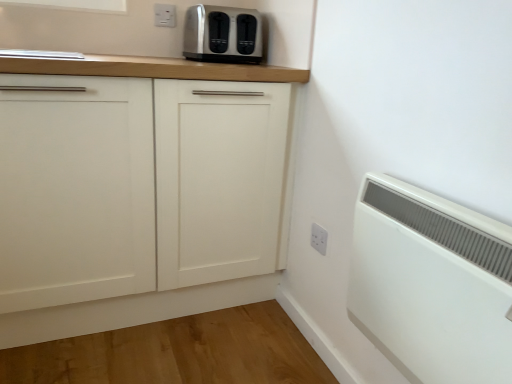
This screenshot has width=512, height=384. Describe the element at coordinates (165, 15) in the screenshot. I see `white plastic electric outlet at upper center, the 1th electric outlet from the top` at that location.

Measure the distance between point (x=104, y=155) and camera.

Point (x=104, y=155) and camera are 4.18 feet apart.

The width and height of the screenshot is (512, 384). What do you see at coordinates (223, 34) in the screenshot?
I see `satin silver toaster at upper center` at bounding box center [223, 34].

In order to click on white plastic electric outlet at upper center, the 1th electric outlet from the top in this screenshot , I will do `click(165, 15)`.

From a real-world perspective, is satin silver toaster at upper center physically located above or below white plastic electric outlet at center, the second electric outlet positioned from the back?

satin silver toaster at upper center is situated higher than white plastic electric outlet at center, the second electric outlet positioned from the back, in the real world.

You are a GUI agent. You are given a task and a screenshot of the screen. Output one action in this format:
    pyautogui.click(x=<x>, y=<y>)
    Task: Click on the electric outlet that is on the right side of satin silver toaster at upper center
    The image size is (512, 384).
    Given the screenshot: What is the action you would take?
    pyautogui.click(x=319, y=238)

Considering the relative sizes of satin silver toaster at upper center and white plastic electric outlet at center, the 1th electric outlet from the bottom, in the image provided, is satin silver toaster at upper center smaller than white plastic electric outlet at center, the 1th electric outlet from the bottom,?

Actually, satin silver toaster at upper center might be larger than white plastic electric outlet at center, the 1th electric outlet from the bottom.

Is the position of satin silver toaster at upper center less distant than that of white plastic electric outlet at center, marked as the first electric outlet in a right-to-left arrangement?

That is False.

Is white matte cabinet at center not close to white plastic electric outlet at upper center, acting as the second electric outlet starting from the right?

No, white matte cabinet at center is not far away from white plastic electric outlet at upper center, acting as the second electric outlet starting from the right.

Considering the relative sizes of white matte cabinet at center and white plastic electric outlet at upper center, acting as the second electric outlet starting from the right, in the image provided, is white matte cabinet at center taller than white plastic electric outlet at upper center, acting as the second electric outlet starting from the right,?

Correct, white matte cabinet at center is much taller as white plastic electric outlet at upper center, acting as the second electric outlet starting from the right.

Considering the sizes of objects white matte cabinet at center and white plastic electric outlet at upper center, the 1th electric outlet from the top, in the image provided, who is wider, white matte cabinet at center or white plastic electric outlet at upper center, the 1th electric outlet from the top,?

white matte cabinet at center.

Consider the image. Who is smaller, white matte cabinet at center or white plastic electric outlet at upper center, the 1th electric outlet from the top?

Smaller between the two is white plastic electric outlet at upper center, the 1th electric outlet from the top.

Identify the location of electric outlet that is on the right side of white plastic electric outlet at upper center, arranged as the first electric outlet when viewed from the back. (319, 238).

Is white plastic electric outlet at upper center, the 2th electric outlet positioned from the front, at the back of white plastic electric outlet at center, acting as the 2th electric outlet starting from the left?

That's not correct — white plastic electric outlet at center, acting as the 2th electric outlet starting from the left, is not looking away from white plastic electric outlet at upper center, the 2th electric outlet positioned from the front.

Does white plastic electric outlet at center, the 1th electric outlet from the bottom, lie in front of white plastic electric outlet at upper center, the 1th electric outlet from the top?

Yes.

From the image's perspective, would you say white plastic electric outlet at center, marked as the first electric outlet in a right-to-left arrangement, is positioned over white plastic electric outlet at upper center, the second electric outlet when ordered from bottom to top?

No, from the image's perspective, white plastic electric outlet at center, marked as the first electric outlet in a right-to-left arrangement, is not above white plastic electric outlet at upper center, the second electric outlet when ordered from bottom to top.

Is satin silver toaster at upper center in front of or behind white matte cabinet at center in the image?

In the image, satin silver toaster at upper center appears behind white matte cabinet at center.

Is satin silver toaster at upper center not within white matte cabinet at center?

Yes.

Is satin silver toaster at upper center oriented towards white matte cabinet at center?

No, satin silver toaster at upper center is not oriented towards white matte cabinet at center.

Is white plastic radiator at lower right to the right of white plastic electric outlet at upper center, acting as the second electric outlet starting from the right, from the viewer's perspective?

Correct, you'll find white plastic radiator at lower right to the right of white plastic electric outlet at upper center, acting as the second electric outlet starting from the right.

Can you confirm if white plastic radiator at lower right is shorter than white plastic electric outlet at upper center, the second electric outlet when ordered from bottom to top?

In fact, white plastic radiator at lower right may be taller than white plastic electric outlet at upper center, the second electric outlet when ordered from bottom to top.

Measure the distance between white plastic radiator at lower right and white plastic electric outlet at upper center, the 1th electric outlet from the top.

The distance of white plastic radiator at lower right from white plastic electric outlet at upper center, the 1th electric outlet from the top, is 1.41 meters.

I want to click on the 2nd electric outlet behind the white plastic radiator at lower right, so click(165, 15).

From the image's perspective, is satin silver toaster at upper center over white plastic electric outlet at upper center, acting as the second electric outlet starting from the right?

No.

Consider the image. Which object is thinner, satin silver toaster at upper center or white plastic electric outlet at upper center, marked as the 1th electric outlet in a left-to-right arrangement?

white plastic electric outlet at upper center, marked as the 1th electric outlet in a left-to-right arrangement.

Is satin silver toaster at upper center at the right side of white plastic electric outlet at upper center, the 2th electric outlet positioned from the front?

Yes.

What's the angular difference between white plastic electric outlet at upper center, arranged as the first electric outlet when viewed from the back, and white plastic radiator at lower right's facing directions?

white plastic electric outlet at upper center, arranged as the first electric outlet when viewed from the back, and white plastic radiator at lower right are facing 86.9 degrees away from each other.

Is white plastic electric outlet at upper center, acting as the second electric outlet starting from the right, touching white plastic radiator at lower right?

white plastic electric outlet at upper center, acting as the second electric outlet starting from the right, is not next to white plastic radiator at lower right, and they're not touching.

Is white plastic electric outlet at upper center, acting as the second electric outlet starting from the right, wider or thinner than white plastic radiator at lower right?

white plastic electric outlet at upper center, acting as the second electric outlet starting from the right, is thinner than white plastic radiator at lower right.

Can you confirm if white plastic electric outlet at upper center, arranged as the first electric outlet when viewed from the back, is taller than white plastic radiator at lower right?

No, white plastic electric outlet at upper center, arranged as the first electric outlet when viewed from the back, is not taller than white plastic radiator at lower right.

You are a GUI agent. You are given a task and a screenshot of the screen. Output one action in this format:
    pyautogui.click(x=<x>, y=<y>)
    Task: Click on the toaster above the white plastic electric outlet at center, marked as the first electric outlet in a right-to-left arrangement (from a real-world perspective)
    This screenshot has width=512, height=384.
    Given the screenshot: What is the action you would take?
    pyautogui.click(x=223, y=34)

Image resolution: width=512 pixels, height=384 pixels. I want to click on the 2nd electric outlet behind the white matte cabinet at center, so click(x=165, y=15).

Estimate the real-world distances between objects in this image. Which object is further from satin silver toaster at upper center, white plastic radiator at lower right or white plastic electric outlet at upper center, acting as the second electric outlet starting from the right?

→ white plastic radiator at lower right lies further to satin silver toaster at upper center than the other object.

When comparing their distances from white plastic radiator at lower right, does white matte cabinet at center or satin silver toaster at upper center seem closer?

white matte cabinet at center is positioned closer to the anchor white plastic radiator at lower right.

In the scene shown: Considering their positions, is white matte cabinet at center positioned closer to white plastic electric outlet at upper center, arranged as the first electric outlet when viewed from the back, than satin silver toaster at upper center?

Based on the image, satin silver toaster at upper center appears to be nearer to white plastic electric outlet at upper center, arranged as the first electric outlet when viewed from the back.

Looking at the image, which one is located further to white plastic electric outlet at upper center, the 1th electric outlet from the top, satin silver toaster at upper center or white matte cabinet at center?

white matte cabinet at center.

Which object lies nearer to the anchor point white plastic electric outlet at upper center, acting as the second electric outlet starting from the right, white matte cabinet at center or white plastic electric outlet at center, the second electric outlet positioned from the back?

white matte cabinet at center lies closer to white plastic electric outlet at upper center, acting as the second electric outlet starting from the right, than the other object.

When comparing their distances from white matte cabinet at center, does satin silver toaster at upper center or white plastic electric outlet at center, acting as the 2th electric outlet starting from the left, seem further?

white plastic electric outlet at center, acting as the 2th electric outlet starting from the left, lies further to white matte cabinet at center than the other object.

Which object lies nearer to the anchor point satin silver toaster at upper center, white plastic electric outlet at center, marked as the first electric outlet in a right-to-left arrangement, or white plastic radiator at lower right?

white plastic electric outlet at center, marked as the first electric outlet in a right-to-left arrangement, is positioned closer to the anchor satin silver toaster at upper center.

From the image, which object appears to be nearer to satin silver toaster at upper center, white plastic electric outlet at upper center, the second electric outlet when ordered from bottom to top, or white plastic electric outlet at center, which ranks as the 1th electric outlet in front-to-back order?

The object closer to satin silver toaster at upper center is white plastic electric outlet at upper center, the second electric outlet when ordered from bottom to top.

The width and height of the screenshot is (512, 384). Identify the location of toaster between white plastic electric outlet at upper center, the second electric outlet when ordered from bottom to top, and white plastic electric outlet at center, the second electric outlet positioned from the back, vertically. (223, 34).

Where is `electric outlet between white plastic radiator at lower right and satin silver toaster at upper center from front to back`? electric outlet between white plastic radiator at lower right and satin silver toaster at upper center from front to back is located at coordinates (319, 238).

Where is `toaster that lies between white plastic electric outlet at upper center, the 2th electric outlet positioned from the front, and white matte cabinet at center from top to bottom`? toaster that lies between white plastic electric outlet at upper center, the 2th electric outlet positioned from the front, and white matte cabinet at center from top to bottom is located at coordinates (223, 34).

Identify the location of cabinetry between white plastic radiator at lower right and satin silver toaster at upper center in the front-back direction. (136, 186).